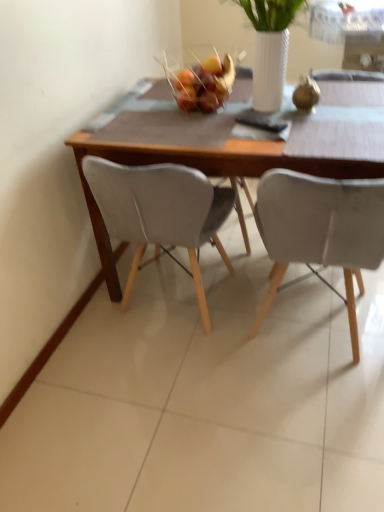
Identify the location of free location in front of glossy plastic fruit basket at center. The height and width of the screenshot is (512, 384). (202, 127).